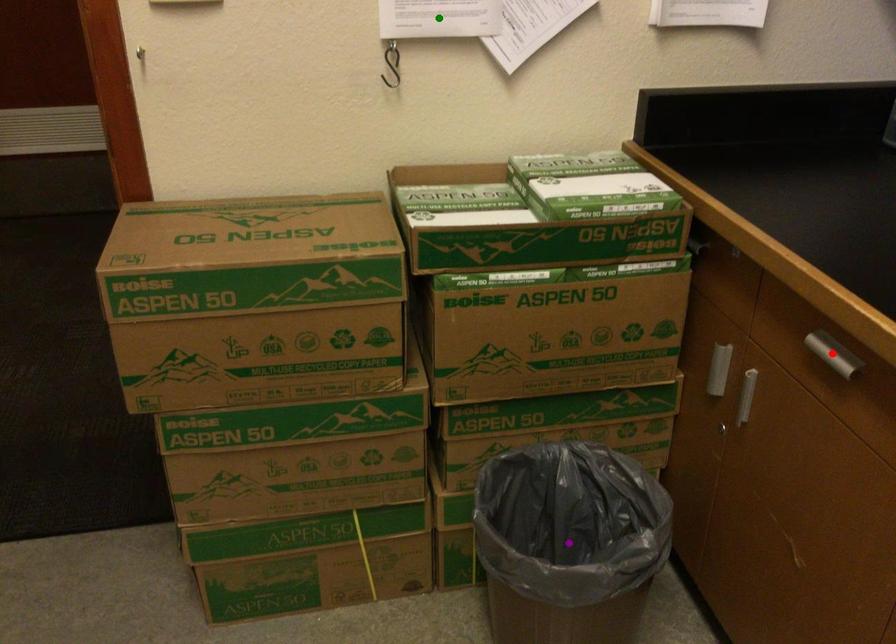
Order these from nearest to farthest:
green point | red point | purple point

red point → green point → purple point